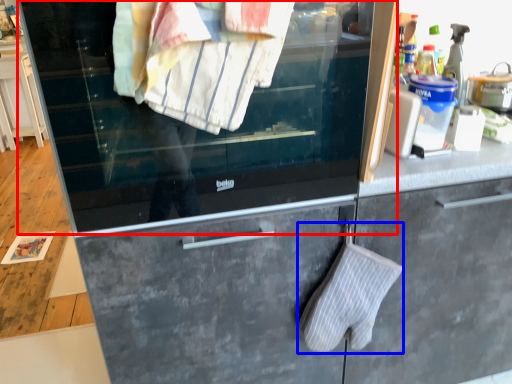
Question: Which of the following is the closest to the observer, window (highlighted by a red box) or bath towel (highlighted by a blue box)?

Choices:
 (A) window
 (B) bath towel

Answer: (A)